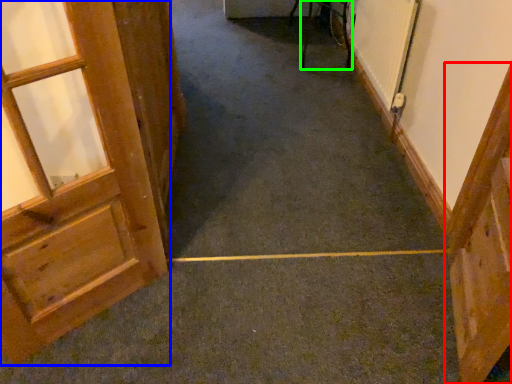
Question: Based on their relative distances, which object is farther from door (highlighted by a red box)? Choose from door (highlighted by a blue box) and furniture (highlighted by a green box).

Choices:
 (A) door
 (B) furniture

Answer: (B)